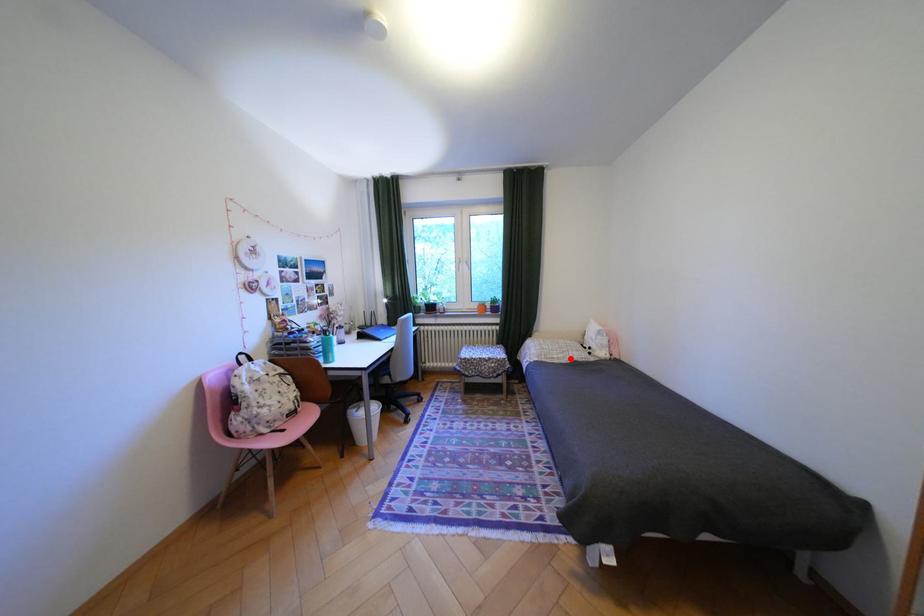
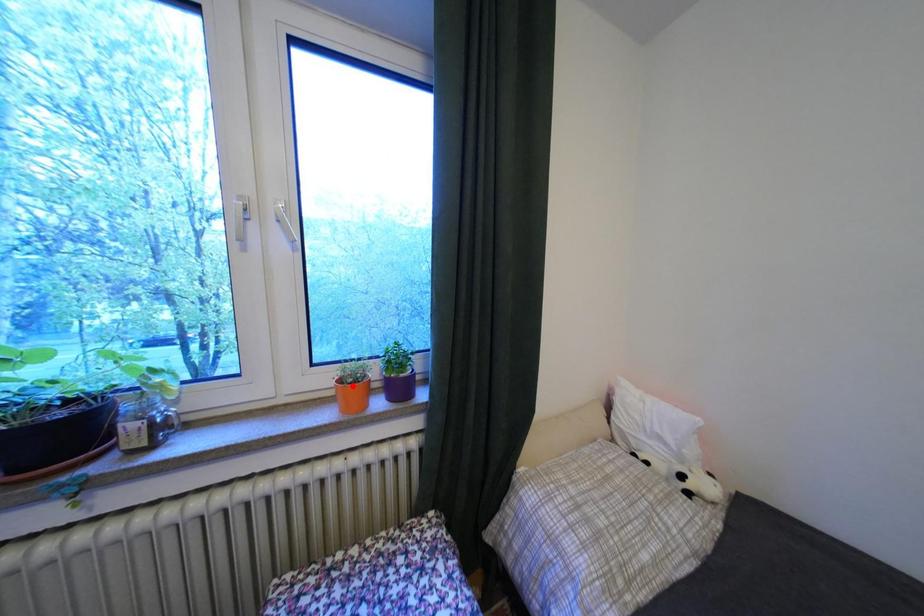
I am providing you with two images of the same scene from different viewpoints. A red point is marked on the first image and another point is marked on the second image. Is the marked point in image1 the same physical position as the marked point in image2?

No